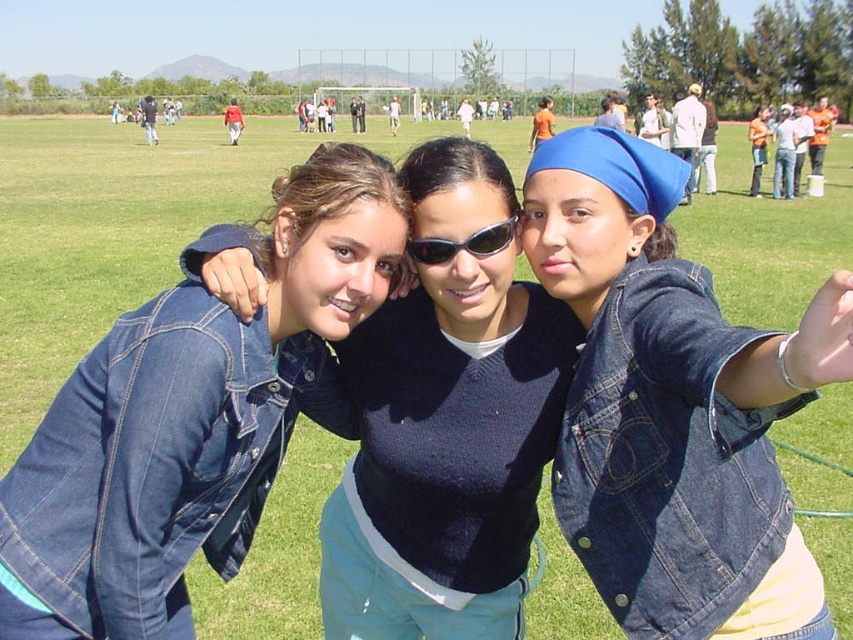
Based on the photo, you are standing in the middle of the sports field and see the blue denim jacket at center and the black plastic goggles at center. Which object is positioned to the left?

The black plastic goggles at center is to the left of the blue denim jacket at center.

You are a photographer trying to capture a group photo of the blue denim jacket at center and the denim jacket at left. Based on their heights, which jacket should be placed in the front row to ensure both are visible?

The blue denim jacket at center is shorter than the denim jacket at left, so placing the blue denim jacket at center in the front row would ensure both are visible.

You are a photographer trying to capture a closeup shot of the blue denim jacket at center and the black plastic goggles at center. Since you want to focus on the goggles, which object should be placed closer to the camera?

The black plastic goggles at center should be placed closer to the camera because they are smaller than the blue denim jacket at center, allowing better focus on them.